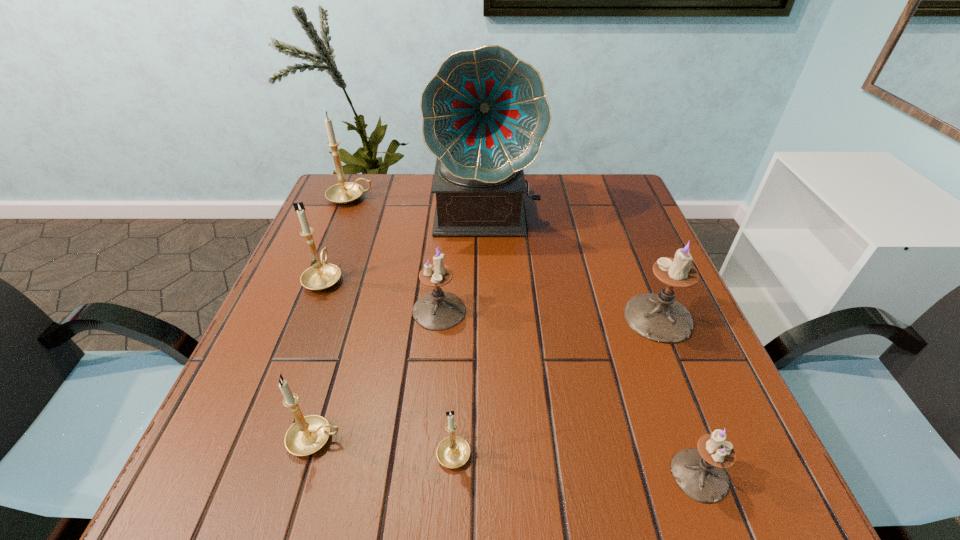
Locate an element on the screen. This screenshot has height=540, width=960. free space that satisfies the following two spatial constraints: 1. on the horn of the tallest object; 2. on the handle side of the second smallest gold candle holder is located at coordinates (490, 439).

Find the location of a particular element. vacant space that satisfies the following two spatial constraints: 1. on the horn of the tallest object; 2. on the right side of the nearest purple candle holder is located at coordinates (491, 475).

You are a GUI agent. You are given a task and a screenshot of the screen. Output one action in this format:
    pyautogui.click(x=<x>, y=<y>)
    Task: Click on the vacant space that satisfies the following two spatial constraints: 1. on the handle side of the tallest candle holder; 2. on the left side of the second biggest purple candle holder
    The height and width of the screenshot is (540, 960).
    Given the screenshot: What is the action you would take?
    pyautogui.click(x=305, y=310)

I want to click on vacant space that satisfies the following two spatial constraints: 1. on the handle side of the smallest gold candle holder; 2. on the handle side of the third biggest gold candle holder, so click(454, 439).

The height and width of the screenshot is (540, 960). Find the location of `free space that satisfies the following two spatial constraints: 1. on the handle side of the nearest purple candle holder; 2. on the right side of the third biggest gold candle holder`. free space that satisfies the following two spatial constraints: 1. on the handle side of the nearest purple candle holder; 2. on the right side of the third biggest gold candle holder is located at coordinates (305, 475).